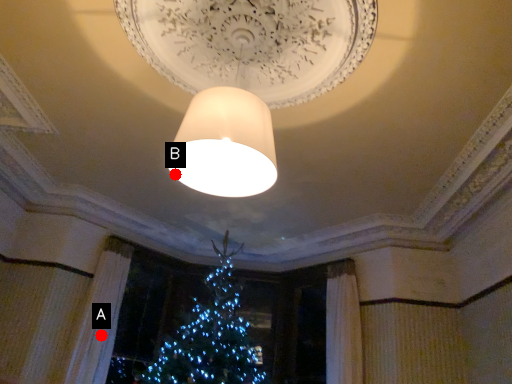
Question: Two points are circled on the image, labeled by A and B beside each circle. Which point appears closest to the camera in this image?

Choices:
 (A) A is closer
 (B) B is closer

Answer: (B)